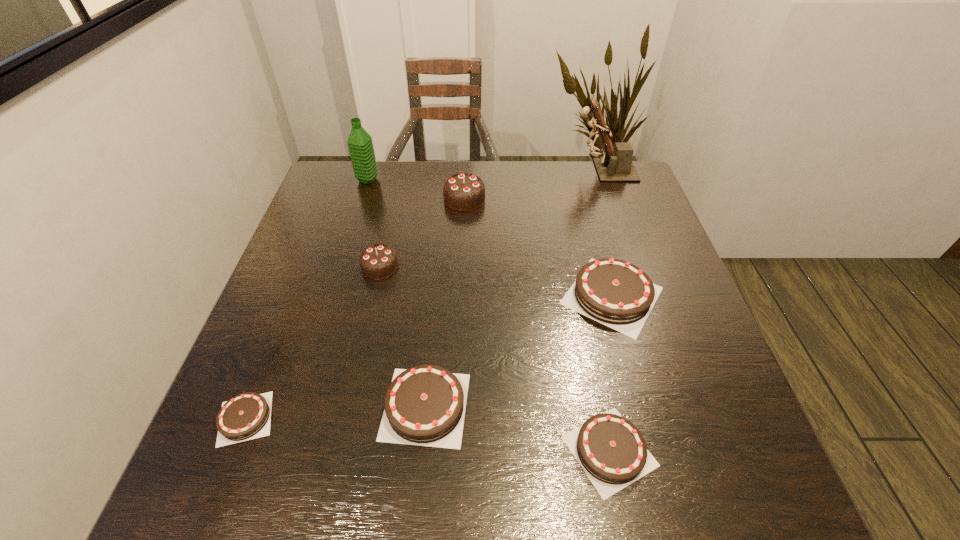
Where is `the third shortest object`? Image resolution: width=960 pixels, height=540 pixels. the third shortest object is located at coordinates (425, 405).

The image size is (960, 540). Identify the location of the third biggest brown chocolate cake. (611, 450).

At what (x,y) coordinates should I click in order to perform the action: click on the fifth tallest chocolate cake. Please return your answer as a coordinate pair (x, y). Image resolution: width=960 pixels, height=540 pixels. Looking at the image, I should click on tap(611, 450).

Identify the location of the shortest object. This screenshot has height=540, width=960. (246, 416).

Find the location of a particular element. the leftmost chocolate cake is located at coordinates (246, 416).

Identify the location of free location located on the front-facing side of the brown figurine. (447, 171).

Identify the location of vacant space positioned 0.270m on the front-facing side of the brown figurine. tap(486, 171).

The width and height of the screenshot is (960, 540). Find the location of `vacant space located 0.290m on the front-facing side of the brown figurine`. vacant space located 0.290m on the front-facing side of the brown figurine is located at coordinates (479, 171).

Locate an element on the screen. The width and height of the screenshot is (960, 540). vacant space situated on the front of the seventh shortest object is located at coordinates (353, 226).

At what (x,y) coordinates should I click in order to perform the action: click on free space located 0.220m on the front of the tallest chocolate cake. Please return your answer as a coordinate pair (x, y). This screenshot has height=540, width=960. Looking at the image, I should click on (462, 267).